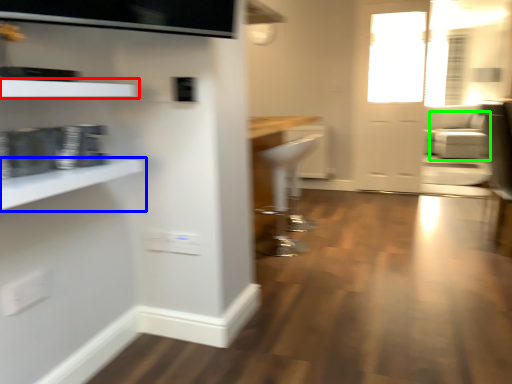
Question: Which is nearer to the shelf (highlighted by a red box)? shelf (highlighted by a blue box) or armchair (highlighted by a green box).

Choices:
 (A) shelf
 (B) armchair

Answer: (A)